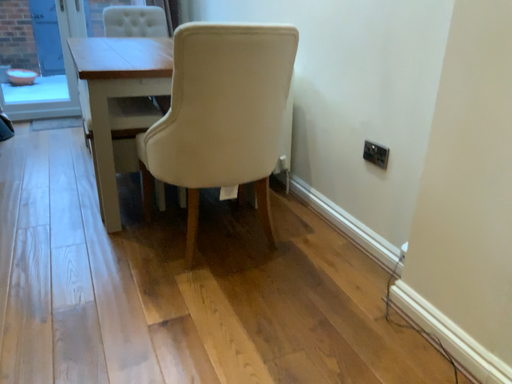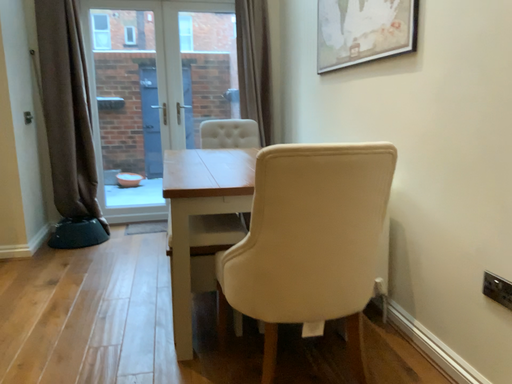
Question: How did the camera likely rotate when shooting the video?

Choices:
 (A) rotated downward
 (B) rotated upward

Answer: (B)